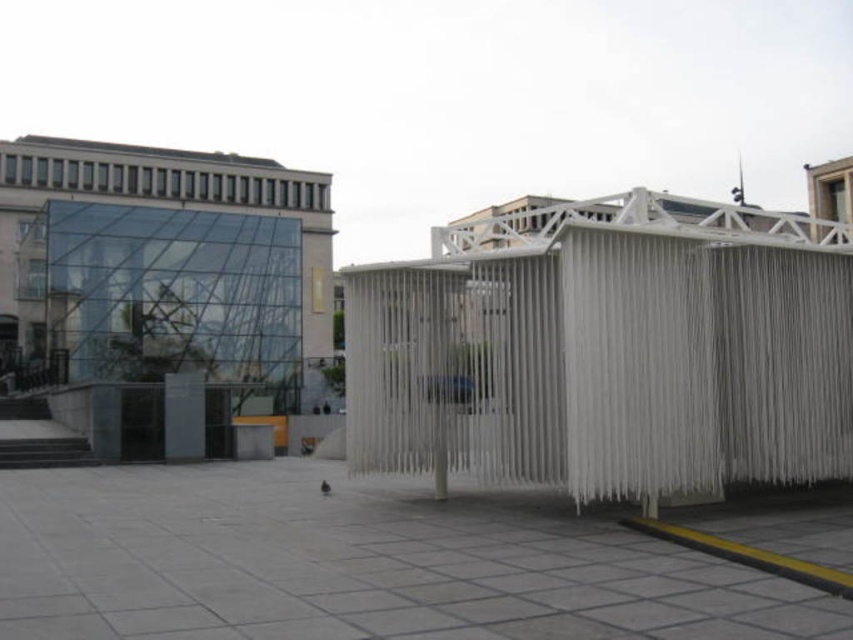
Question: Which object is closer to the camera taking this photo?

Choices:
 (A) transparent glass building at upper left
 (B) white woven structure at center

Answer: (B)

Question: Among these points, which one is nearest to the camera?

Choices:
 (A) (164, 262)
 (B) (757, 301)

Answer: (B)

Question: Does white woven structure at center have a smaller size compared to transparent glass building at upper left?

Choices:
 (A) yes
 (B) no

Answer: (A)

Question: Is white woven structure at center closer to camera compared to transparent glass building at upper left?

Choices:
 (A) no
 (B) yes

Answer: (B)

Question: Can you confirm if white woven structure at center is smaller than transparent glass building at upper left?

Choices:
 (A) yes
 (B) no

Answer: (A)